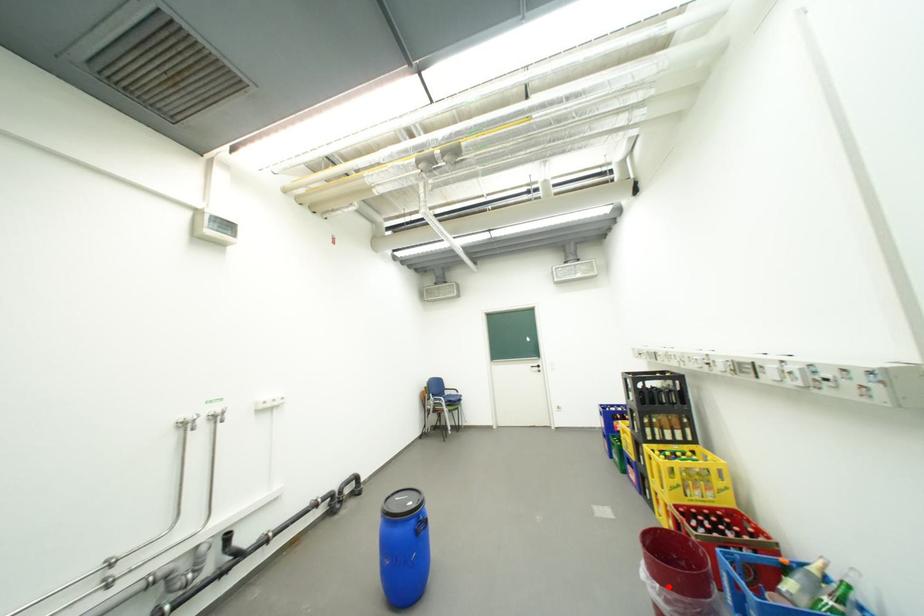
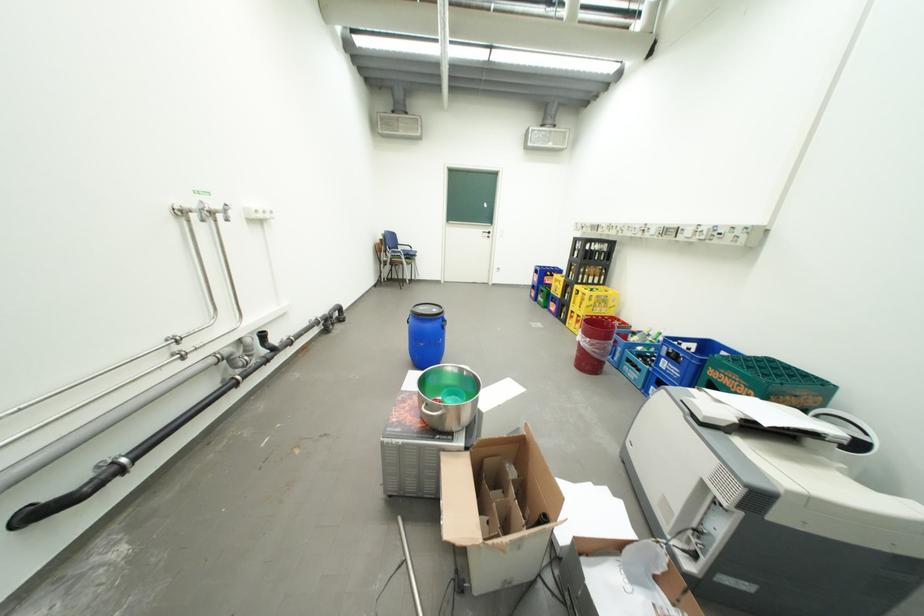
Question: I am providing you with two images of the same scene from different viewpoints. A red point is shown in image1. For the corresponding object point in image2, is it positioned nearer or farther from the camera?

Choices:
 (A) Nearer
 (B) Farther

Answer: (A)